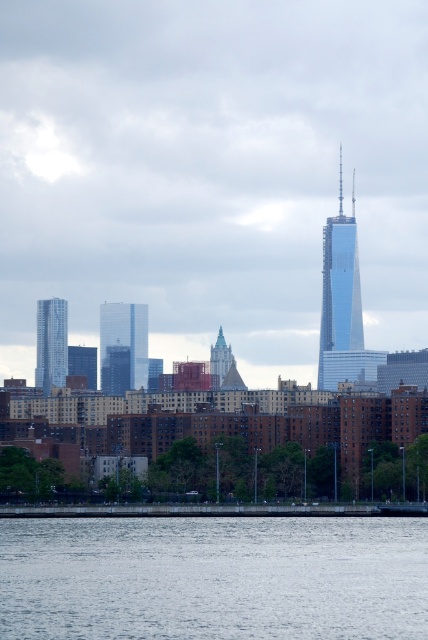
Question: Is gray water at lower center further to the viewer compared to shiny glass skyscraper at center?

Choices:
 (A) yes
 (B) no

Answer: (A)

Question: Is metallic glass skyscraper at left to the left of matte teal glass tower at center from the viewer's perspective?

Choices:
 (A) yes
 (B) no

Answer: (A)

Question: Can you confirm if shiny glass skyscraper at center is wider than matte teal glass tower at center?

Choices:
 (A) yes
 (B) no

Answer: (A)

Question: Which point appears farthest from the camera in this image?

Choices:
 (A) (181, 568)
 (B) (146, 372)
 (C) (211, 378)

Answer: (A)

Question: Which point appears farthest from the camera in this image?

Choices:
 (A) (44, 332)
 (B) (353, 275)
 (C) (140, 381)

Answer: (A)

Question: Which point appears farthest from the camera in this image?

Choices:
 (A) (220, 380)
 (B) (39, 305)
 (C) (124, 356)

Answer: (B)